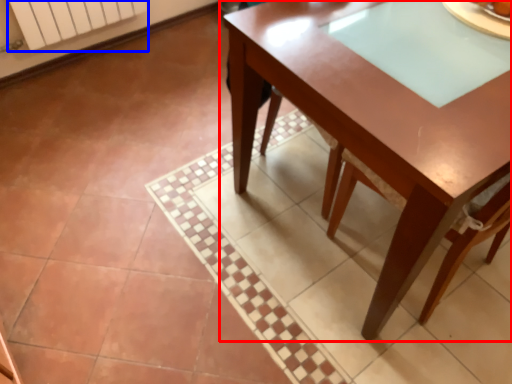
Question: Which point is closer to the camera, table (highlighted by a red box) or radiator (highlighted by a blue box)?

Choices:
 (A) table
 (B) radiator

Answer: (A)